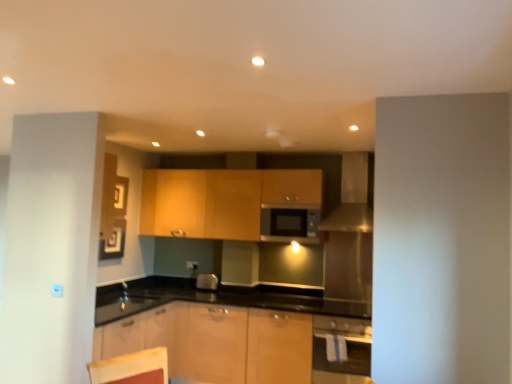
The width and height of the screenshot is (512, 384). In order to click on satin silver exhaust hood at upper right in this screenshot , I will do (x=352, y=197).

The height and width of the screenshot is (384, 512). I want to click on matte wood cabinets at center, so click(222, 201).

Which is correct: matte silver microwave at center is inside satin silver exhaust hood at upper right, or outside of it?

matte silver microwave at center exists outside the volume of satin silver exhaust hood at upper right.

From the image's perspective, is matte silver microwave at center located beneath satin silver exhaust hood at upper right?

Correct, matte silver microwave at center appears lower than satin silver exhaust hood at upper right in the image.

Based on the photo, considering the relative positions of matte silver microwave at center and satin silver exhaust hood at upper right in the image provided, is matte silver microwave at center to the left of satin silver exhaust hood at upper right from the viewer's perspective?

Yes.

From a real-world perspective, which object rests below the other?

matte silver microwave at center, from a real-world perspective.

Is matte silver microwave at center not near white glossy oven at lower right?

Indeed, matte silver microwave at center is not near white glossy oven at lower right.

From the image's perspective, between matte silver microwave at center and white glossy oven at lower right, who is located below?

white glossy oven at lower right, from the image's perspective.

Can you confirm if matte silver microwave at center is thinner than white glossy oven at lower right?

Yes, matte silver microwave at center is thinner than white glossy oven at lower right.

Considering their positions, is matte silver microwave at center located in front of or behind white glossy oven at lower right?

In the image, matte silver microwave at center appears behind white glossy oven at lower right.

Considering the relative sizes of matte wood cabinets at center and matte silver microwave at center in the image provided, is matte wood cabinets at center smaller than matte silver microwave at center?

No, matte wood cabinets at center is not smaller than matte silver microwave at center.

From the image's perspective, is matte wood cabinets at center below matte silver microwave at center?

No, from the image's perspective, matte wood cabinets at center is not below matte silver microwave at center.

Are satin silver exhaust hood at upper right and matte wood cabinets at center beside each other?

They are not placed beside each other.

Is satin silver exhaust hood at upper right not within matte wood cabinets at center?

Absolutely, satin silver exhaust hood at upper right is external to matte wood cabinets at center.

Which is closer to the camera, (357,169) or (287,177)?

Clearly, point (357,169) is closer to the camera than point (287,177).

From the image's perspective, between satin silver exhaust hood at upper right and matte wood cabinets at center, which one is located above?

satin silver exhaust hood at upper right, from the image's perspective.

Which is in front, point (154, 222) or point (359, 186)?

Positioned in front is point (359, 186).

Can you confirm if matte wood cabinets at center is thinner than satin silver exhaust hood at upper right?

Yes, matte wood cabinets at center is thinner than satin silver exhaust hood at upper right.

From the image's perspective, which object appears higher, matte wood cabinets at center or satin silver exhaust hood at upper right?

satin silver exhaust hood at upper right, from the image's perspective.

Is matte wood cabinets at center far away from satin silver exhaust hood at upper right?

They are positioned close to each other.

From a real-world perspective, is matte silver microwave at center physically below matte wood cabinets at center?

Correct, in the physical world, matte silver microwave at center is lower than matte wood cabinets at center.

From the image's perspective, is matte silver microwave at center positioned above or below matte wood cabinets at center?

matte silver microwave at center is situated lower than matte wood cabinets at center in the image.

In terms of height, does matte silver microwave at center look taller or shorter compared to matte wood cabinets at center?

matte silver microwave at center is shorter than matte wood cabinets at center.

Which of these two, white glossy oven at lower right or matte wood cabinets at center, stands shorter?

Standing shorter between the two is white glossy oven at lower right.

What's the angular difference between white glossy oven at lower right and matte wood cabinets at center's facing directions?

The angle between the facing direction of white glossy oven at lower right and the facing direction of matte wood cabinets at center is 1.97 degrees.

In the image, there is a white glossy oven at lower right. Where is `cabinetry above it (from the image's perspective)`? Image resolution: width=512 pixels, height=384 pixels. cabinetry above it (from the image's perspective) is located at coordinates (222, 201).

Is white glossy oven at lower right thinner than matte wood cabinets at center?

No.

You are a GUI agent. You are given a task and a screenshot of the screen. Output one action in this format:
    pyautogui.click(x=<x>, y=<y>)
    Task: Click on the appliance below the satin silver exhaust hood at upper right (from a real-world perspective)
    The width and height of the screenshot is (512, 384).
    Given the screenshot: What is the action you would take?
    pyautogui.click(x=290, y=224)

Where is `appliance lying on the left of white glossy oven at lower right`? The width and height of the screenshot is (512, 384). appliance lying on the left of white glossy oven at lower right is located at coordinates (290, 224).

Considering their positions, is matte wood cabinets at center positioned further to white glossy oven at lower right than matte silver microwave at center?

matte wood cabinets at center lies further to white glossy oven at lower right than the other object.

From the image, which object appears to be nearer to white glossy oven at lower right, satin silver exhaust hood at upper right or matte silver microwave at center?

matte silver microwave at center is closer to white glossy oven at lower right.

From the image, which object appears to be nearer to matte silver microwave at center, white glossy oven at lower right or satin silver exhaust hood at upper right?

Based on the image, satin silver exhaust hood at upper right appears to be nearer to matte silver microwave at center.

Looking at the image, which one is located further to matte silver microwave at center, satin silver exhaust hood at upper right or matte wood cabinets at center?

The object further to matte silver microwave at center is matte wood cabinets at center.

Estimate the real-world distances between objects in this image. Which object is closer to matte wood cabinets at center, white glossy oven at lower right or satin silver exhaust hood at upper right?

Based on the image, satin silver exhaust hood at upper right appears to be nearer to matte wood cabinets at center.

Looking at this image, looking at the image, which one is located further to matte wood cabinets at center, matte silver microwave at center or satin silver exhaust hood at upper right?

satin silver exhaust hood at upper right is positioned further to the anchor matte wood cabinets at center.

From the image, which object appears to be nearer to matte wood cabinets at center, white glossy oven at lower right or matte silver microwave at center?

The object closer to matte wood cabinets at center is matte silver microwave at center.

Considering their positions, is white glossy oven at lower right positioned closer to satin silver exhaust hood at upper right than matte silver microwave at center?

matte silver microwave at center is closer to satin silver exhaust hood at upper right.

The image size is (512, 384). Find the location of `cabinetry between satin silver exhaust hood at upper right and white glossy oven at lower right vertically`. cabinetry between satin silver exhaust hood at upper right and white glossy oven at lower right vertically is located at coordinates (222, 201).

Image resolution: width=512 pixels, height=384 pixels. Identify the location of appliance between satin silver exhaust hood at upper right and white glossy oven at lower right in the vertical direction. (290, 224).

Find the location of a particular element. The image size is (512, 384). appliance that lies between matte wood cabinets at center and white glossy oven at lower right from top to bottom is located at coordinates (290, 224).

Identify the location of appliance between matte wood cabinets at center and satin silver exhaust hood at upper right from left to right. (290, 224).